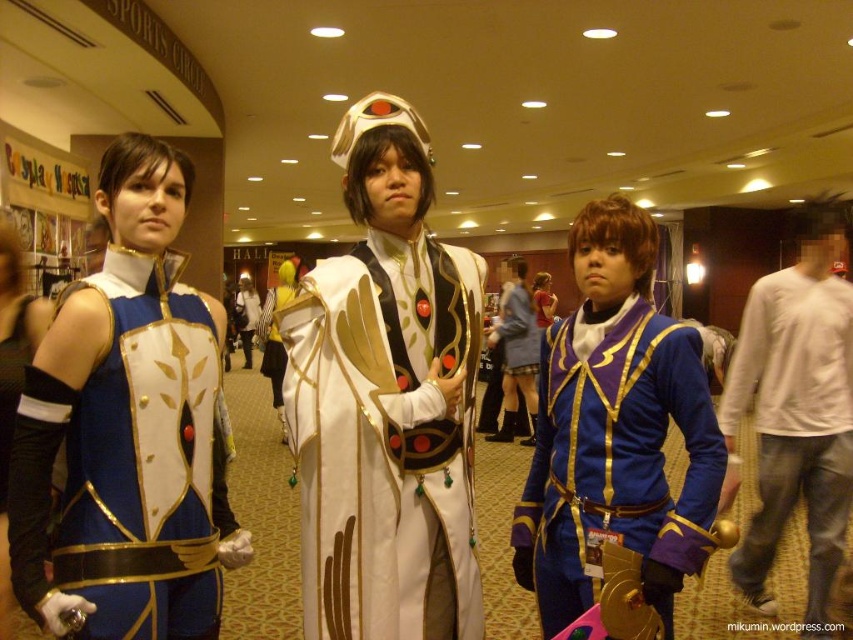
Question: Is white cotton shirt at center above white satin cape at center?

Choices:
 (A) yes
 (B) no

Answer: (B)

Question: Does matte blue fabric vest at left appear under blue satin jacket at center?

Choices:
 (A) yes
 (B) no

Answer: (B)

Question: Can you confirm if matte white dress at center is positioned to the left of white satin cape at center?

Choices:
 (A) no
 (B) yes

Answer: (A)

Question: Considering the real-world distances, which object is farthest from the matte white dress at center?

Choices:
 (A) blue satin jacket at center
 (B) white satin robe at center

Answer: (B)

Question: Which point is farther from the camera taking this photo?

Choices:
 (A) (524, 342)
 (B) (816, 572)

Answer: (A)

Question: Considering the real-world distances, which object is closest to the blue satin jacket at center?

Choices:
 (A) matte blue fabric vest at left
 (B) matte white dress at center
 (C) white satin cape at center
 (D) white satin robe at center

Answer: (D)